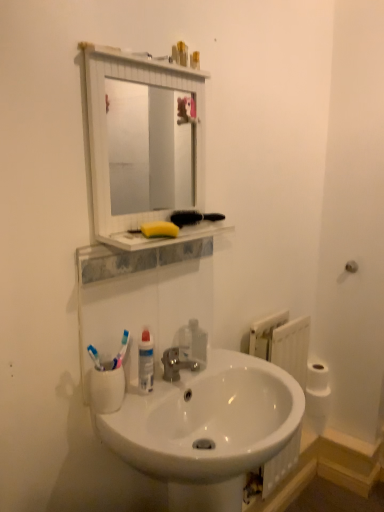
Question: Based on their sizes in the image, would you say white plastic radiator at lower right is bigger or smaller than white matte toilet paper at right?

Choices:
 (A) big
 (B) small

Answer: (A)

Question: Considering the positions of point (294, 350) and point (311, 365), is point (294, 350) closer or farther from the camera than point (311, 365)?

Choices:
 (A) farther
 (B) closer

Answer: (B)

Question: Which of these objects is positioned farthest from the white glossy sink at center?

Choices:
 (A) translucent plastic container at upper center
 (B) transparent plastic soap dispenser at sink
 (C) yellow sponge at upper center
 (D) white plastic radiator at lower right
 (E) yellow sponge at upper center

Answer: (A)

Question: Which object is positioned closest to the silver metallic faucet at center?

Choices:
 (A) white glossy sink at center
 (B) transparent plastic soap dispenser at sink
 (C) yellow sponge at upper center
 (D) yellow sponge at upper center
 (E) white matte toilet paper at right

Answer: (B)